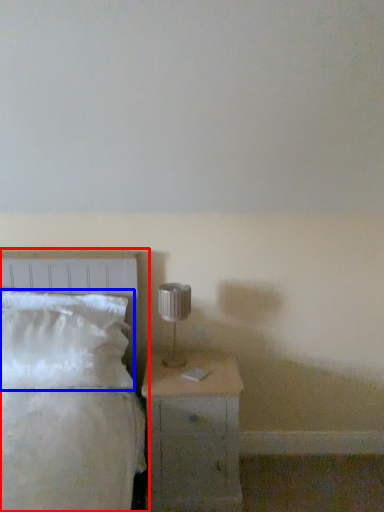
Question: Which object appears closest to the camera in this image, bed (highlighted by a red box) or pillow (highlighted by a blue box)?

Choices:
 (A) bed
 (B) pillow

Answer: (A)